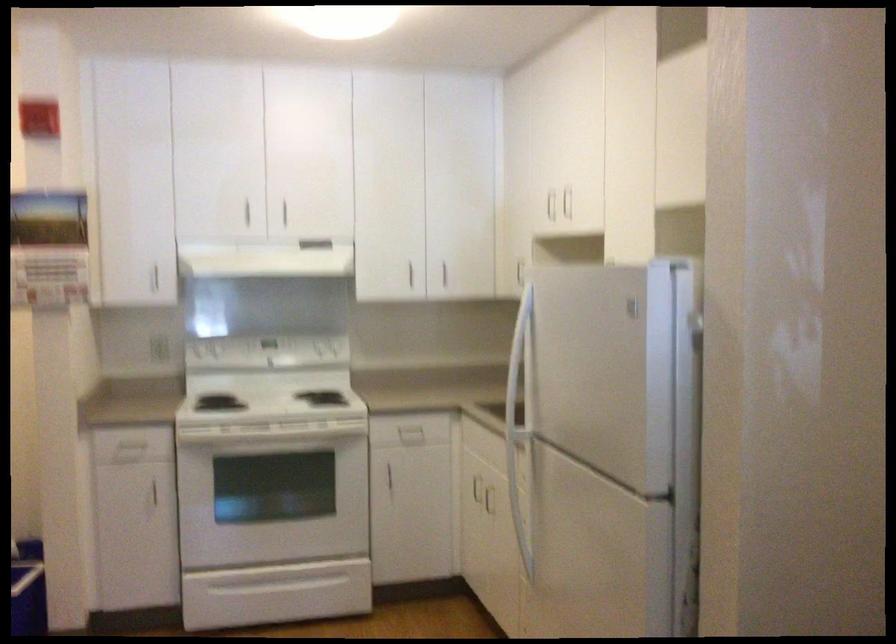
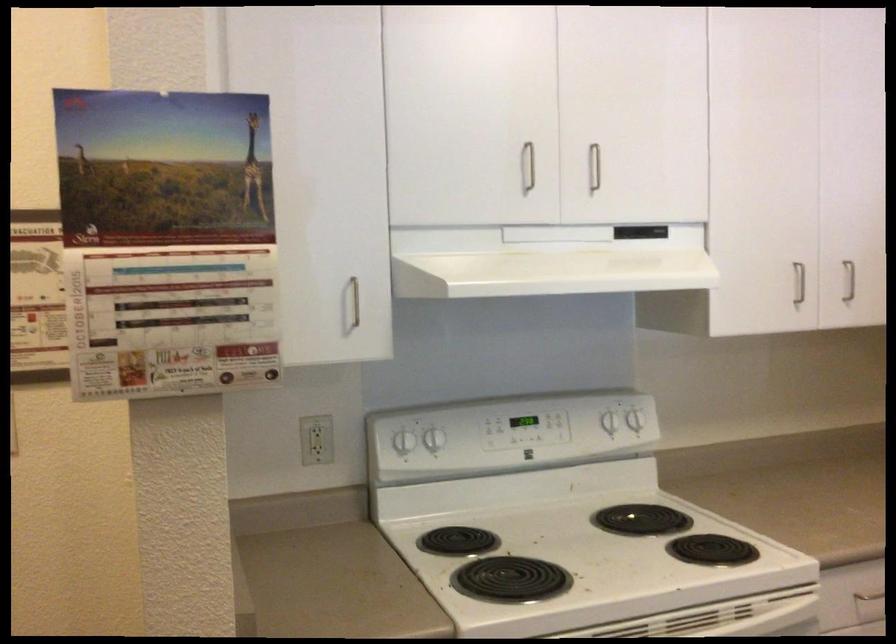
Find the pixel in the second image that matches point (196, 345) in the first image.

(400, 433)